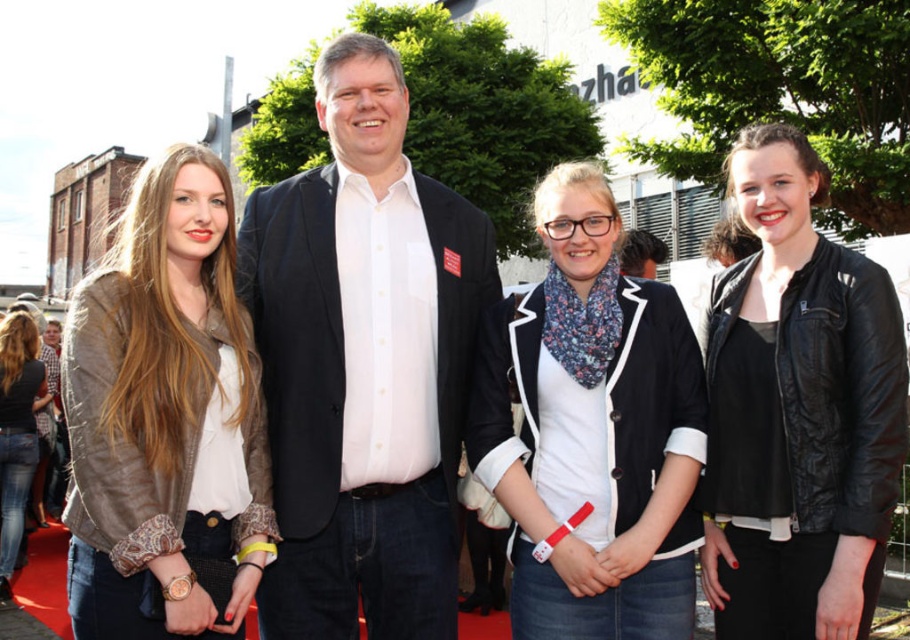
Is point (240, 412) positioned behind point (796, 314)?

Yes, it is behind point (796, 314).

Does leather jacket at left appear on the left side of black leather jacket at center?

Indeed, leather jacket at left is positioned on the left side of black leather jacket at center.

Who is more forward, (186, 372) or (840, 294)?

Positioned in front is point (186, 372).

Locate an element on the screen. The image size is (910, 640). leather jacket at left is located at coordinates (165, 417).

Can you confirm if black matte suit at center is taller than denim jacket at lower left?

Yes.

Measure the distance between point (334, 240) and camera.

A distance of 25.10 meters exists between point (334, 240) and camera.

Is point (436, 280) less distant than point (1, 531)?

That is True.

What are the coordinates of `black matte suit at center` in the screenshot? It's located at (364, 364).

Is point (420, 403) positioned behind point (532, 627)?

Yes, it is behind point (532, 627).

Is black matte suit at center to the right of white cotton shirt at center from the viewer's perspective?

Incorrect, black matte suit at center is not on the right side of white cotton shirt at center.

Does point (332, 211) come farther from viewer compared to point (497, 408)?

Yes.

At what (x,y) coordinates should I click in order to perform the action: click on black matte suit at center. Please return your answer as a coordinate pair (x, y). The width and height of the screenshot is (910, 640). Looking at the image, I should click on (364, 364).